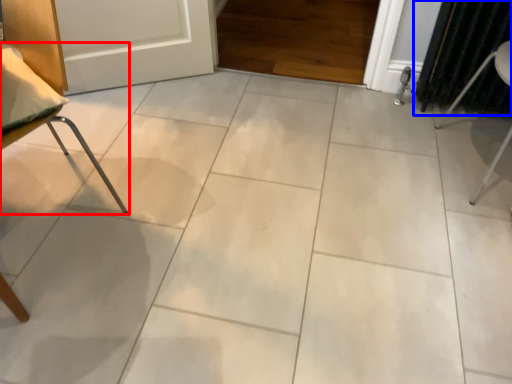
Question: Which point is closer to the camera, furniture (highlighted by a red box) or curtain (highlighted by a blue box)?

Choices:
 (A) furniture
 (B) curtain

Answer: (A)